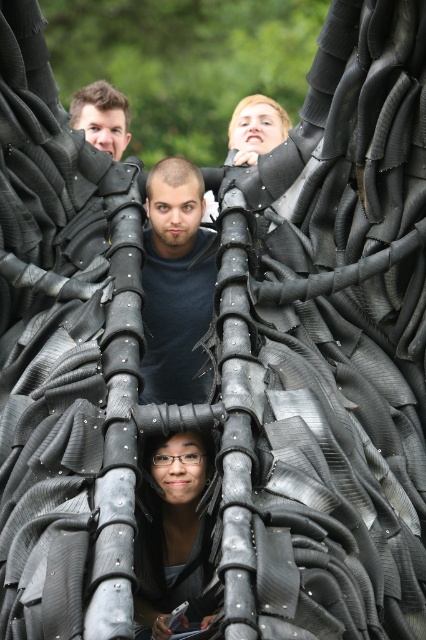
Question: Which point appears farthest from the camera in this image?

Choices:
 (A) (154, 300)
 (B) (97, 136)

Answer: (B)

Question: Does matte black hair at center appear over matte black face at upper left?

Choices:
 (A) no
 (B) yes

Answer: (A)

Question: Which of the following is the closest to the observer?

Choices:
 (A) (75, 93)
 (B) (207, 452)

Answer: (B)

Question: Which of the following is the farthest from the observer?

Choices:
 (A) matte black face at upper left
 (B) matte black hair at center

Answer: (A)

Question: Does matte black shirt at center appear over matte black face at upper left?

Choices:
 (A) no
 (B) yes

Answer: (A)

Question: Can you confirm if matte black hair at center is positioned to the right of matte black face at upper left?

Choices:
 (A) no
 (B) yes

Answer: (B)